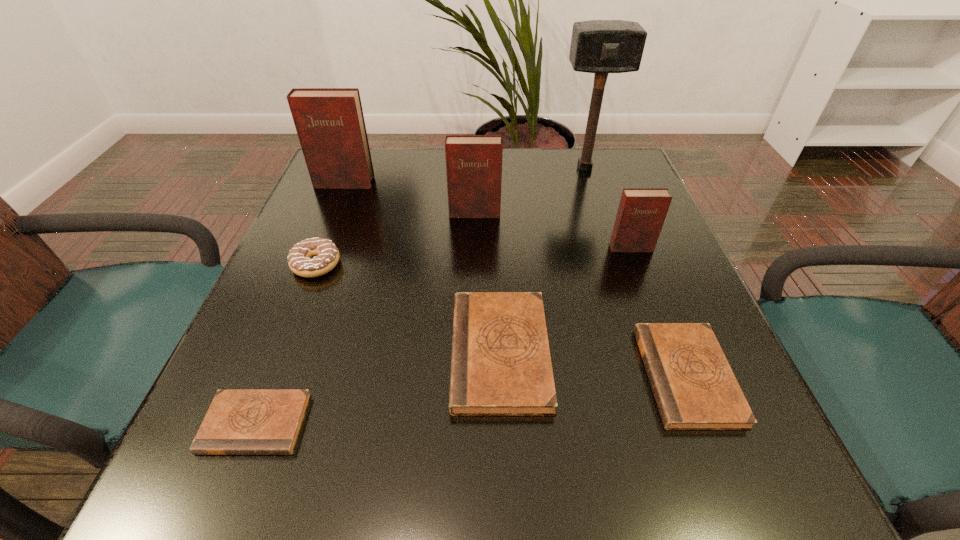
Find the location of `vacant point located on the right of the chocolate doughnut`. vacant point located on the right of the chocolate doughnut is located at coordinates (445, 265).

Where is `free region located 0.170m on the spine side of the third shortest diary`? free region located 0.170m on the spine side of the third shortest diary is located at coordinates (349, 353).

I want to click on free space located 0.050m on the spine side of the third shortest diary, so click(x=422, y=353).

This screenshot has height=540, width=960. I want to click on free spot located 0.200m on the spine side of the third shortest diary, so click(331, 353).

The image size is (960, 540). I want to click on free spot located on the spine side of the rightmost brown diary, so (x=570, y=376).

This screenshot has width=960, height=540. Find the location of `free spot located 0.060m on the spine side of the rightmost brown diary`. free spot located 0.060m on the spine side of the rightmost brown diary is located at coordinates (609, 376).

Locate an element on the screen. The height and width of the screenshot is (540, 960). vacant space located 0.380m on the spine side of the rightmost brown diary is located at coordinates (405, 376).

Identify the location of mallet that is at the far edge. (597, 46).

I want to click on diary situated at the far edge, so click(330, 124).

Find the location of a particular element. The image size is (960, 540). object located in the near edge section of the desktop is located at coordinates (238, 422).